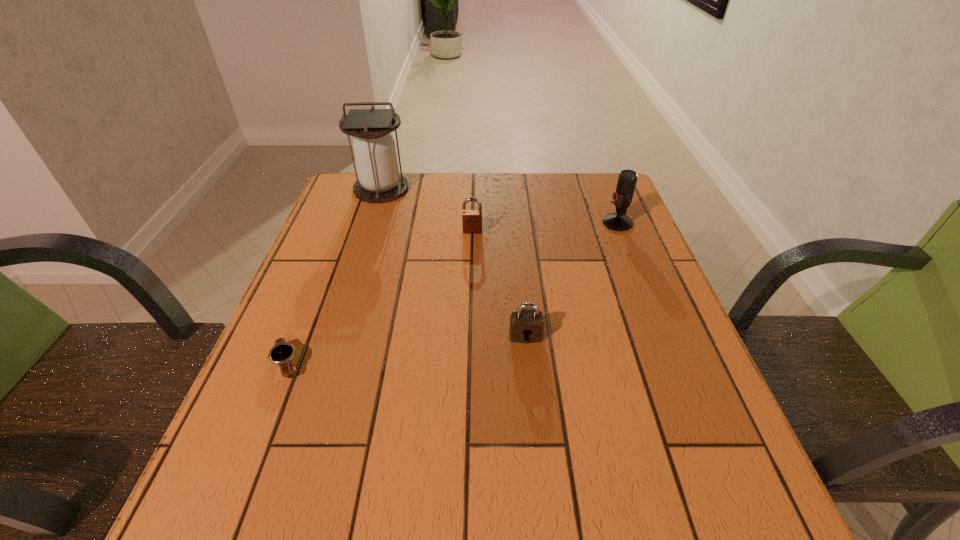
Locate an element on the screen. the tallest object is located at coordinates (379, 181).

Locate an element on the screen. The width and height of the screenshot is (960, 540). the farthest object is located at coordinates (379, 181).

Image resolution: width=960 pixels, height=540 pixels. I want to click on microphone, so click(618, 221).

This screenshot has height=540, width=960. Find the location of `the fourth shortest object`. the fourth shortest object is located at coordinates (618, 221).

In order to click on the left padlock in this screenshot , I will do `click(471, 219)`.

Locate an element on the screen. The image size is (960, 540). the third object from left to right is located at coordinates (471, 219).

I want to click on the fourth farthest object, so click(x=526, y=326).

This screenshot has height=540, width=960. In order to click on the nearer padlock in this screenshot , I will do `click(526, 326)`.

Identify the location of watch. The width and height of the screenshot is (960, 540). (282, 352).

In order to click on the nearest object in this screenshot , I will do (x=282, y=352).